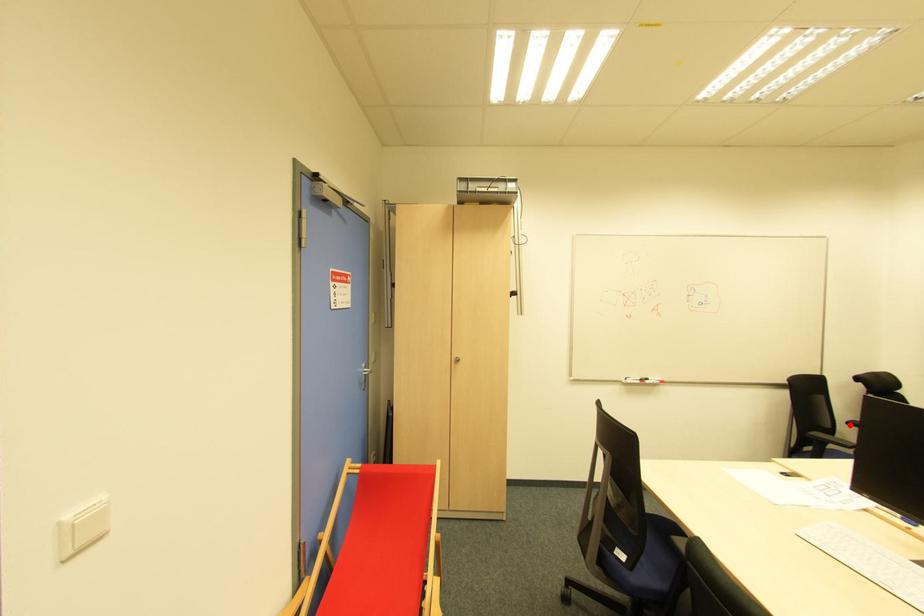
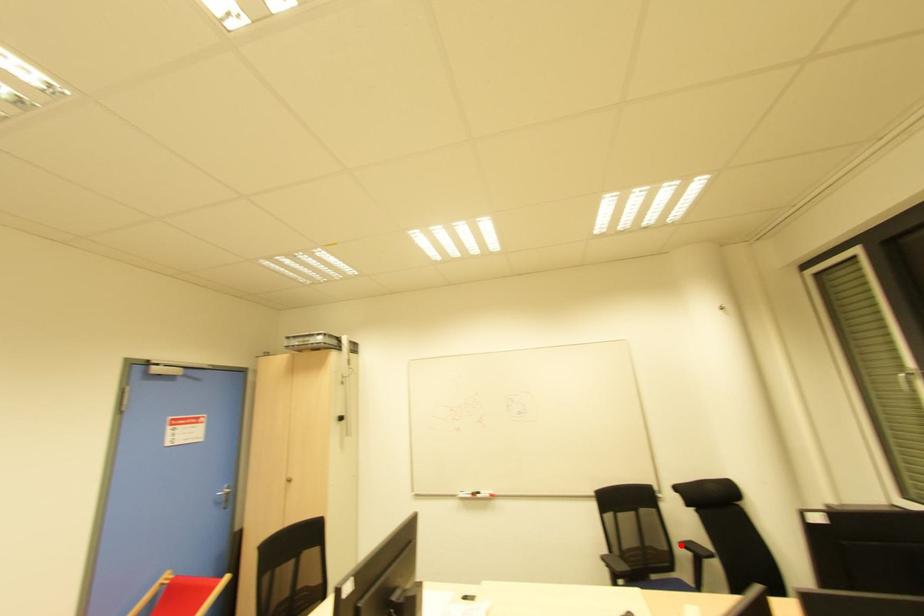
I am providing you with two images of the same scene from different viewpoints. A red point is marked on the first image and another point is marked on the second image. Is the red point in image1 aligned with the point shown in image2?

Yes